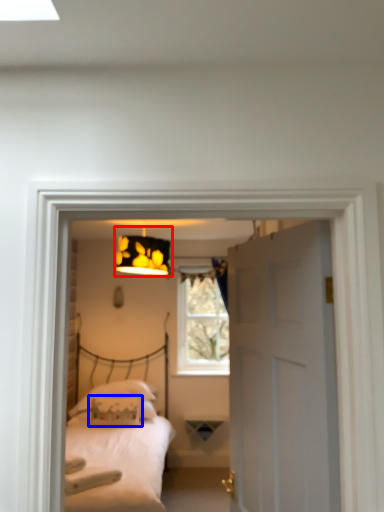
Question: Which of the following is the farthest to the observer, lamp (highlighted by a red box) or pillow (highlighted by a blue box)?

Choices:
 (A) lamp
 (B) pillow

Answer: (B)